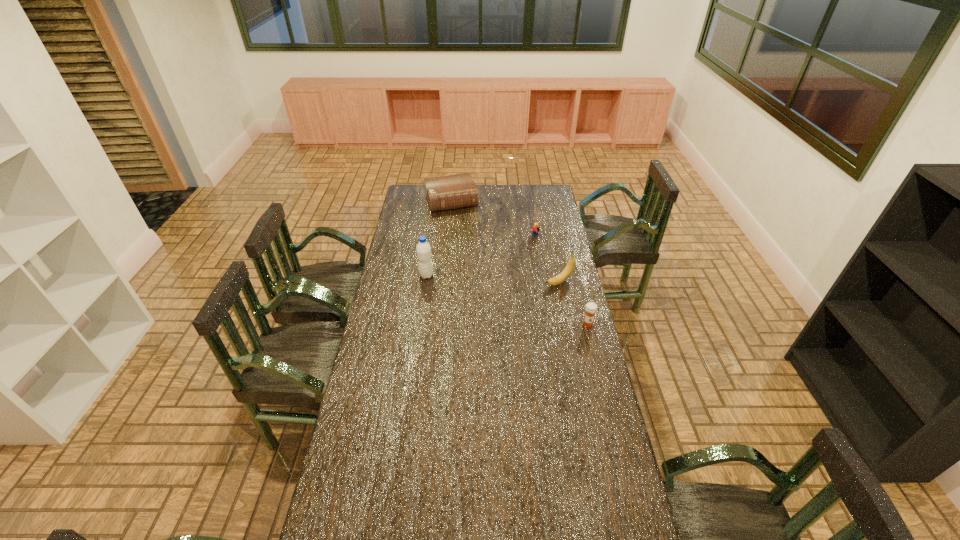
Find the location of a particular element. This screenshot has width=960, height=540. the tallest object is located at coordinates (423, 249).

The image size is (960, 540). In order to click on the nearest object in this screenshot , I will do `click(591, 308)`.

You are a GUI agent. You are given a task and a screenshot of the screen. Output one action in this format:
    pyautogui.click(x=<x>, y=<y>)
    Task: Click on the Lego
    
    Given the screenshot: What is the action you would take?
    pyautogui.click(x=535, y=229)

You are a GUI agent. You are given a task and a screenshot of the screen. Output one action in this format:
    pyautogui.click(x=<x>, y=<y>)
    Task: Click on the banana
    This screenshot has width=960, height=540.
    Given the screenshot: What is the action you would take?
    pyautogui.click(x=567, y=271)

At what (x,y) coordinates should I click in order to perform the action: click on Bible. Please return your answer as a coordinate pair (x, y). Image resolution: width=960 pixels, height=540 pixels. Looking at the image, I should click on (450, 192).

Identify the location of free space located 0.320m on the back of the tallest object. (432, 233).

You are a GUI agent. You are given a task and a screenshot of the screen. Output one action in this format:
    pyautogui.click(x=<x>, y=<y>)
    Task: Click on the vacant space located 0.210m on the label side of the medicine
    
    Given the screenshot: What is the action you would take?
    pyautogui.click(x=599, y=369)

Identify the location of blank space located 0.120m on the front-facing side of the second farthest object. (525, 254).

The height and width of the screenshot is (540, 960). Identify the location of free space located 0.150m on the front-facing side of the second farthest object. (522, 257).

What are the coordinates of `free region located on the front-facing side of the second farthest object` in the screenshot? It's located at (519, 261).